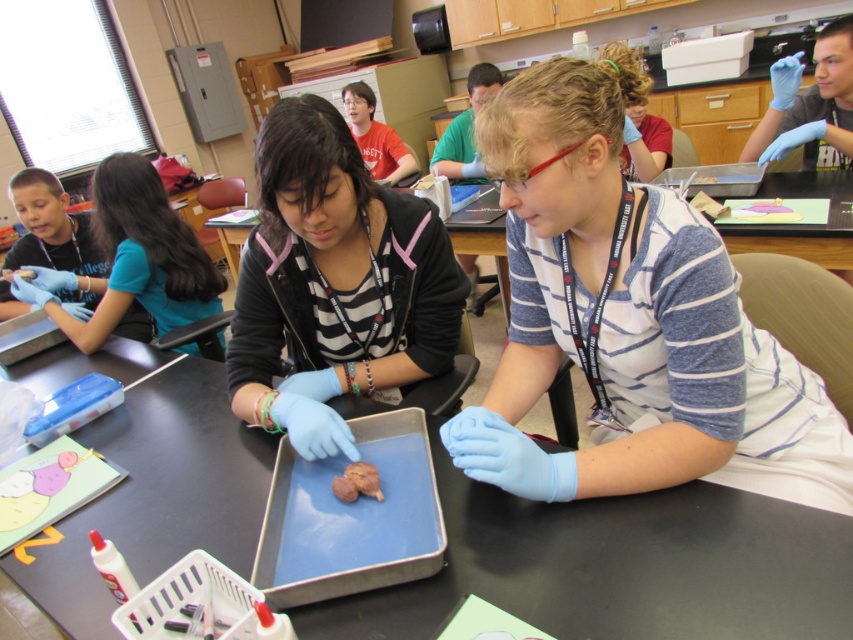
Question: Which object appears closest to the camera in this image?

Choices:
 (A) blue rubber glove at left
 (B) blue rubber glove at center
 (C) matte black shirt at center

Answer: (B)

Question: Among these points, which one is farthest from the camera?

Choices:
 (A) (612, 385)
 (B) (138, 189)
 (C) (386, 212)

Answer: (B)

Question: Where is matte black shirt at center located in relation to blue rubber glove at left in the image?

Choices:
 (A) below
 (B) above

Answer: (A)

Question: Where is blue rubber glove at center located in relation to matte black shirt at center in the image?

Choices:
 (A) below
 (B) above

Answer: (A)

Question: Does blue rubber glove at center have a smaller size compared to matte black shirt at center?

Choices:
 (A) yes
 (B) no

Answer: (B)

Question: Based on their relative distances, which object is nearer to the matte black shirt at center?

Choices:
 (A) blue rubber glove at left
 (B) blue rubber glove at center

Answer: (B)